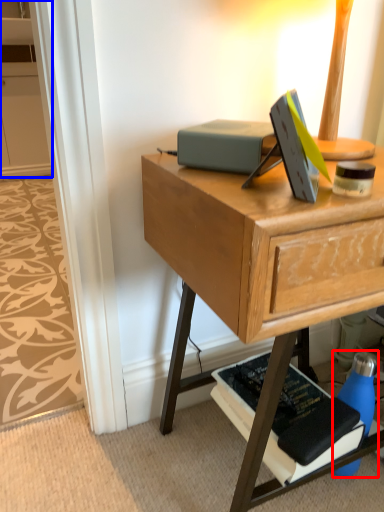
Question: Which object appears closest to the camera in this image, bottle (highlighted by a red box) or cabinetry (highlighted by a blue box)?

Choices:
 (A) bottle
 (B) cabinetry

Answer: (A)